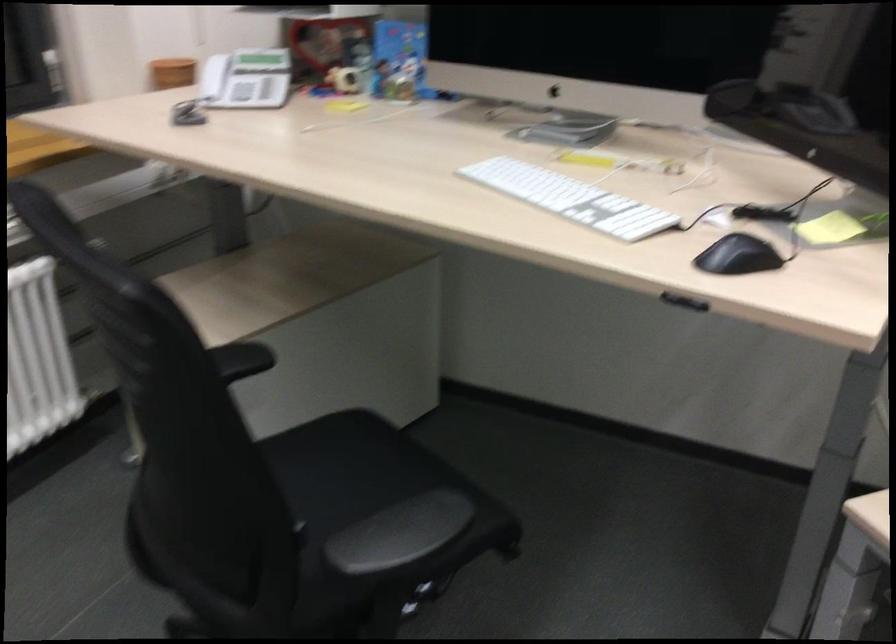
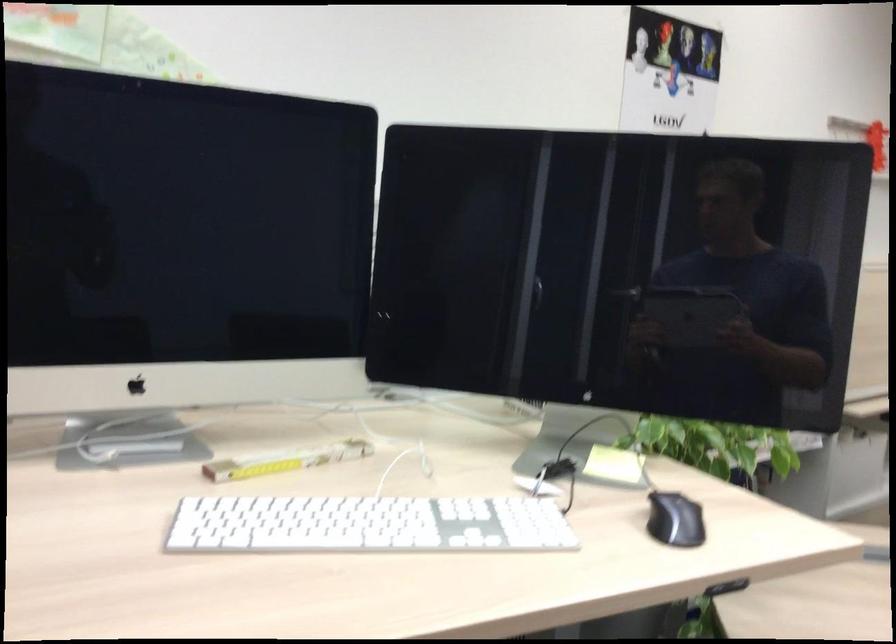
Question: The first image is from the beginning of the video and the second image is from the end. How did the camera likely rotate when shooting the video?

Choices:
 (A) Left
 (B) Right
 (C) Up
 (D) Down

Answer: (B)